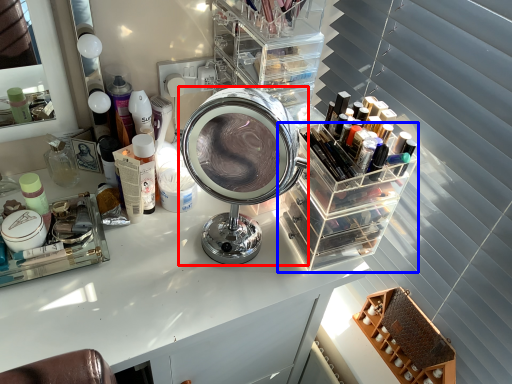
Question: Among these objects, which one is nearest to the camera, scale (highlighted by a red box) or glass box (highlighted by a blue box)?

Choices:
 (A) scale
 (B) glass box

Answer: (A)